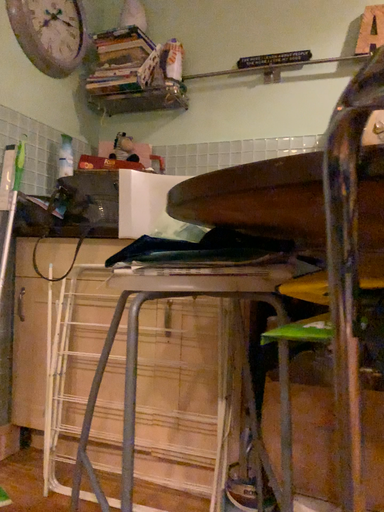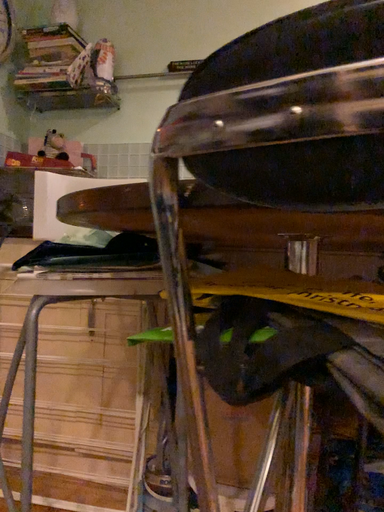
Question: How did the camera likely rotate when shooting the video?

Choices:
 (A) rotated right
 (B) rotated left

Answer: (A)